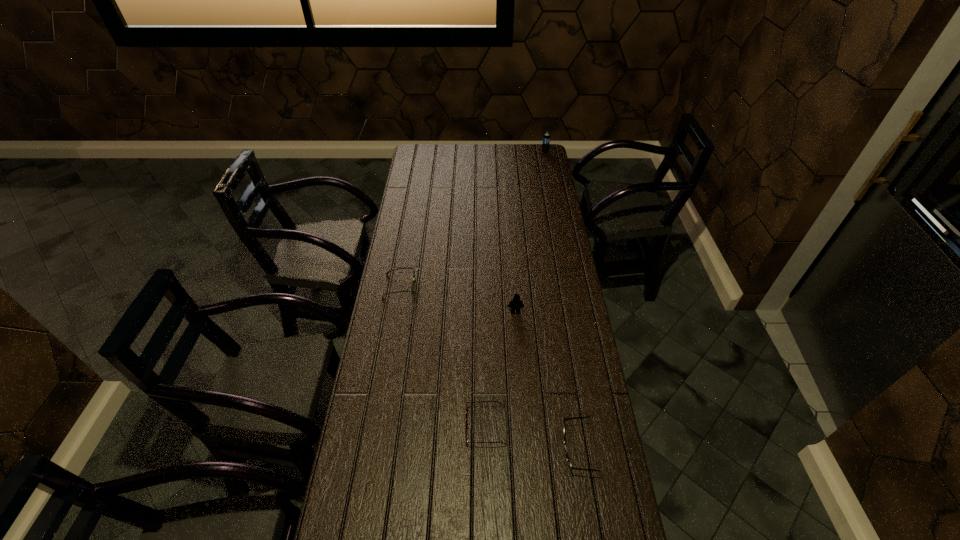
Point out which spectacles is positioned as the second nearest to the shortest spectacles. Please provide its 2D coordinates. Your answer should be formatted as a tuple, i.e. [(x, y)], where the tuple contains the x and y coordinates of a point satisfying the conditions above.

[(412, 285)]

The width and height of the screenshot is (960, 540). I want to click on spectacles that is the closest to the second spectacles from right to left, so 567,456.

Identify the location of vacant point that satisfies the following two spatial constraints: 1. on the face of the second tallest object; 2. on the lenses of the shortest object. (523, 427).

Locate an element on the screen. free region that satisfies the following two spatial constraints: 1. on the front side of the soda bottle; 2. on the front-facing side of the third tallest object is located at coordinates (603, 449).

Identify the location of vacant space that satisfies the following two spatial constraints: 1. on the front side of the tallest object; 2. on the front-facing side of the third shortest object. The image size is (960, 540). (603, 449).

Locate an element on the screen. The image size is (960, 540). vacant space that satisfies the following two spatial constraints: 1. on the face of the third object from right to left; 2. on the lenses of the shortest object is located at coordinates (523, 427).

The width and height of the screenshot is (960, 540). In order to click on free location that satisfies the following two spatial constraints: 1. on the face of the Lego; 2. on the lenses of the shortest object in this screenshot , I will do 523,427.